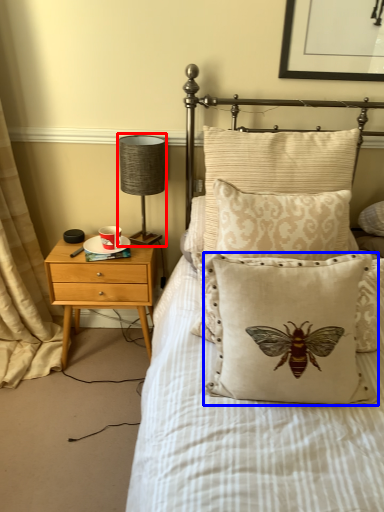
Question: Among these objects, which one is nearest to the camera, table lamp (highlighted by a red box) or pillow (highlighted by a blue box)?

Choices:
 (A) table lamp
 (B) pillow

Answer: (B)